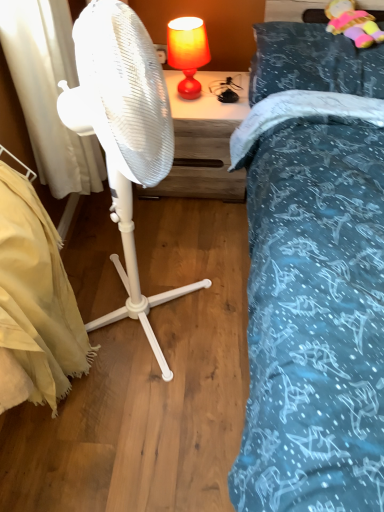
Describe the element at coordinates (352, 23) in the screenshot. I see `fluffy plush toy at upper right` at that location.

What do you see at coordinates (203, 141) in the screenshot? This screenshot has height=512, width=384. I see `wooden nightstand at center` at bounding box center [203, 141].

Where is `white plastic fan at center`? The width and height of the screenshot is (384, 512). white plastic fan at center is located at coordinates (123, 133).

The height and width of the screenshot is (512, 384). Identify the location of white fabric curtain at left. (49, 93).

Locate an element on the screen. teal fabric pillow at upper right is located at coordinates (312, 62).

Locate an element on the screen. Image resolution: width=384 pixels, height=512 pixels. beige fabric mattress at lower left is located at coordinates (35, 303).

The image size is (384, 512). I want to click on fluffy plush toy at upper right, so click(x=352, y=23).

Can you confirm if white plastic fan at center is taller than beige fabric mattress at lower left?

Yes, white plastic fan at center is taller than beige fabric mattress at lower left.

Is white plastic fan at center aimed at beige fabric mattress at lower left?

No.

At what (x,y) coordinates should I click in order to perform the action: click on mattress behind the white plastic fan at center. Please return your answer as a coordinate pair (x, y). Looking at the image, I should click on (35, 303).

Consider the image. Is the depth of white plastic fan at center less than that of beige fabric mattress at lower left?

Yes, the depth of white plastic fan at center is less than that of beige fabric mattress at lower left.

Is wooden nightstand at center completely or partially outside of white fabric curtain at left?

Yes, wooden nightstand at center is outside of white fabric curtain at left.

Does wooden nightstand at center have a lesser width compared to white fabric curtain at left?

In fact, wooden nightstand at center might be wider than white fabric curtain at left.

Who is shorter, wooden nightstand at center or white fabric curtain at left?

wooden nightstand at center is shorter.

From a real-world perspective, which object stands above the other?

white fabric curtain at left.

From the picture: Is fluffy plush toy at upper right wider than white fabric curtain at left?

Indeed, fluffy plush toy at upper right has a greater width compared to white fabric curtain at left.

Which object is closer to the camera, fluffy plush toy at upper right or white fabric curtain at left?

white fabric curtain at left.

Choose the correct answer: Is fluffy plush toy at upper right inside white fabric curtain at left or outside it?

fluffy plush toy at upper right is not inside white fabric curtain at left, it's outside.

Is fluffy plush toy at upper right facing towards white fabric curtain at left?

No, fluffy plush toy at upper right is not aimed at white fabric curtain at left.

Does teal fabric pillow at upper right have a greater width compared to fluffy plush toy at upper right?

Yes, teal fabric pillow at upper right is wider than fluffy plush toy at upper right.

This screenshot has width=384, height=512. In order to click on pillow located in front of the fluffy plush toy at upper right in this screenshot , I will do `click(312, 62)`.

From a real-world perspective, which object rests below the other?

In real-world perspective, teal fabric pillow at upper right is lower.

Can you confirm if teal fabric pillow at upper right is taller than fluffy plush toy at upper right?

No, teal fabric pillow at upper right is not taller than fluffy plush toy at upper right.

Is white fabric curtain at left smaller than matte orange lampshade at upper center?

No, white fabric curtain at left is not smaller than matte orange lampshade at upper center.

Considering their positions, is white fabric curtain at left located in front of or behind matte orange lampshade at upper center?

In the image, white fabric curtain at left appears in front of matte orange lampshade at upper center.

Are white fabric curtain at left and matte orange lampshade at upper center located far from each other?

white fabric curtain at left is near matte orange lampshade at upper center, not far away.

Find the location of `curtain above the matte orange lampshade at upper center (from a real-world perspective)`. curtain above the matte orange lampshade at upper center (from a real-world perspective) is located at coordinates (49, 93).

Consider the image. Considering the relative sizes of fluffy plush toy at upper right and teal fabric pillow at upper right in the image provided, is fluffy plush toy at upper right wider than teal fabric pillow at upper right?

No, fluffy plush toy at upper right is not wider than teal fabric pillow at upper right.

Locate an element on the screen. The height and width of the screenshot is (512, 384). toy on the right of teal fabric pillow at upper right is located at coordinates (352, 23).

In the scene shown: Does fluffy plush toy at upper right have a greater height compared to teal fabric pillow at upper right?

Indeed, fluffy plush toy at upper right has a greater height compared to teal fabric pillow at upper right.

Considering the sizes of fluffy plush toy at upper right and teal fabric pillow at upper right in the image, is fluffy plush toy at upper right bigger or smaller than teal fabric pillow at upper right?

Considering their sizes, fluffy plush toy at upper right takes up less space than teal fabric pillow at upper right.

Are beige fabric mattress at lower left and wooden nightstand at center making contact?

beige fabric mattress at lower left and wooden nightstand at center are not in contact.

Is beige fabric mattress at lower left positioned beyond the bounds of wooden nightstand at center?

Yes, beige fabric mattress at lower left is not within wooden nightstand at center.

Is beige fabric mattress at lower left thinner than wooden nightstand at center?

Yes, beige fabric mattress at lower left is thinner than wooden nightstand at center.

Consider the image. Considering the positions of objects beige fabric mattress at lower left and wooden nightstand at center in the image provided, who is more to the left, beige fabric mattress at lower left or wooden nightstand at center?

From the viewer's perspective, beige fabric mattress at lower left appears more on the left side.

The height and width of the screenshot is (512, 384). What are the coordinates of `mattress on the left side of white plastic fan at center` in the screenshot? It's located at (35, 303).

The height and width of the screenshot is (512, 384). In order to click on curtain below the wooden nightstand at center (from the image's perspective) in this screenshot , I will do `click(49, 93)`.

Which object lies further to the anchor point white fabric curtain at left, wooden nightstand at center or fluffy plush toy at upper right?

Based on the image, fluffy plush toy at upper right appears to be further to white fabric curtain at left.

From the picture: Which object lies further to the anchor point beige fabric mattress at lower left, white fabric curtain at left or fluffy plush toy at upper right?

The object further to beige fabric mattress at lower left is fluffy plush toy at upper right.

Based on the photo, looking at the image, which one is located closer to teal fabric pillow at upper right, matte orange lampshade at upper center or beige fabric mattress at lower left?

matte orange lampshade at upper center is positioned closer to the anchor teal fabric pillow at upper right.

Looking at the image, which one is located closer to matte orange lampshade at upper center, teal fabric pillow at upper right or fluffy plush toy at upper right?

Based on the image, teal fabric pillow at upper right appears to be nearer to matte orange lampshade at upper center.

When comparing their distances from wooden nightstand at center, does teal fabric pillow at upper right or matte orange lampshade at upper center seem further?

teal fabric pillow at upper right.

Estimate the real-world distances between objects in this image. Which object is further from matte orange lampshade at upper center, white plastic fan at center or white fabric curtain at left?

Among the two, white plastic fan at center is located further to matte orange lampshade at upper center.

Considering their positions, is matte orange lampshade at upper center positioned closer to wooden nightstand at center than beige fabric mattress at lower left?

The object closer to wooden nightstand at center is matte orange lampshade at upper center.

Looking at the image, which one is located closer to white plastic fan at center, wooden nightstand at center or teal fabric pillow at upper right?

Based on the image, wooden nightstand at center appears to be nearer to white plastic fan at center.

The image size is (384, 512). Find the location of `table lamp between teal fabric pillow at upper right and beige fabric mattress at lower left in the vertical direction`. table lamp between teal fabric pillow at upper right and beige fabric mattress at lower left in the vertical direction is located at coordinates (187, 52).

Find the location of a particular element. Image resolution: width=384 pixels, height=512 pixels. curtain between white plastic fan at center and wooden nightstand at center in the front-back direction is located at coordinates (49, 93).

Locate an element on the screen. This screenshot has height=512, width=384. toy positioned between white plastic fan at center and matte orange lampshade at upper center from near to far is located at coordinates (352, 23).

Locate an element on the screen. This screenshot has width=384, height=512. mechanical fan between beige fabric mattress at lower left and teal fabric pillow at upper right in the horizontal direction is located at coordinates (123, 133).